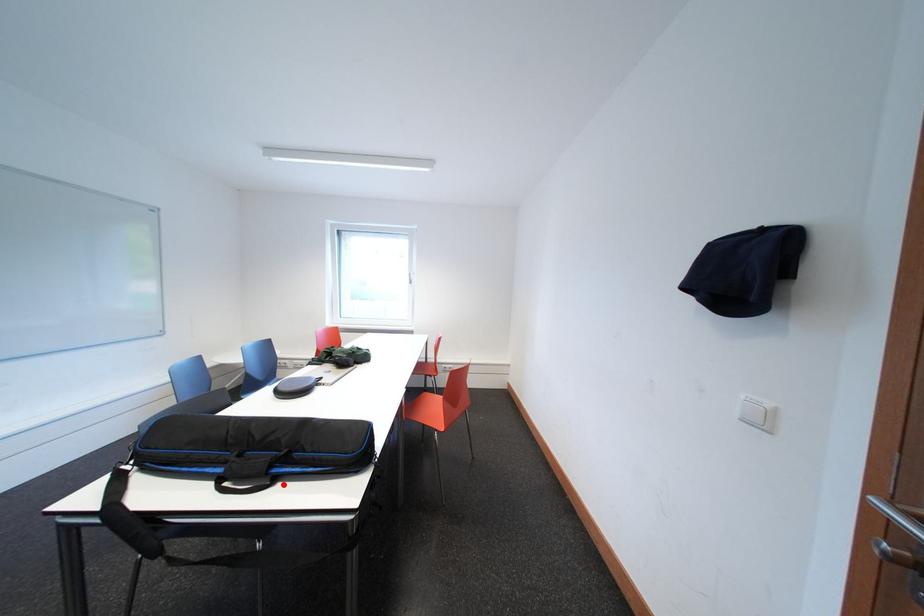
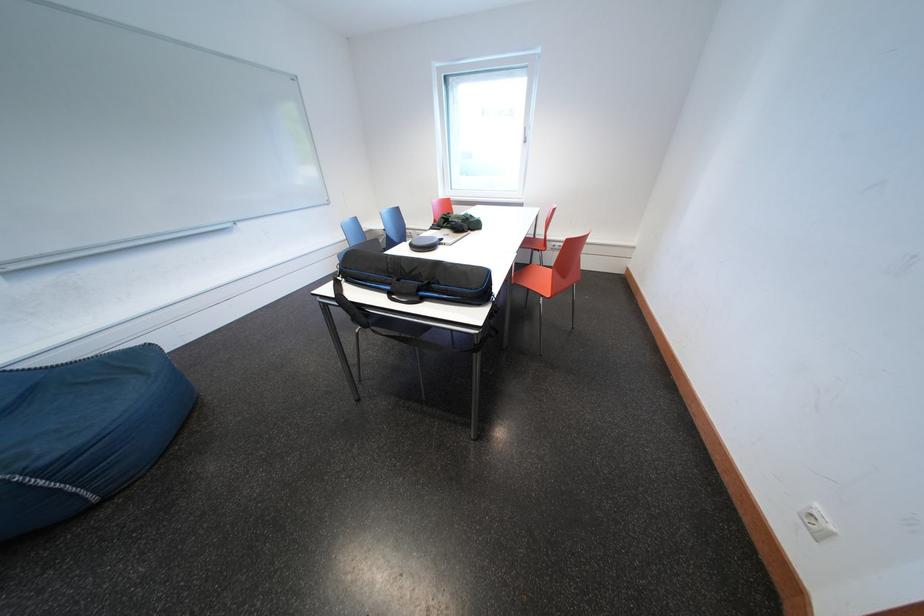
The point at the highlighted location is marked in the first image. Where is the corresponding point in the second image?

(431, 304)